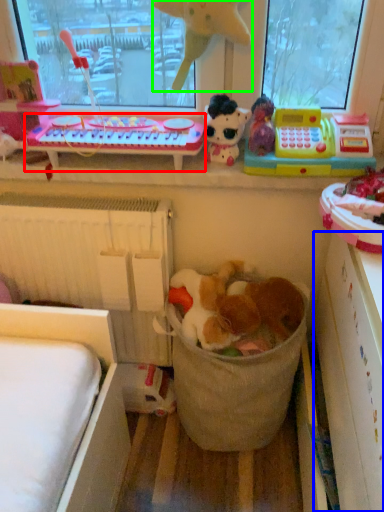
Question: Which object is the closest to the changing table (highlighted by a red box)? Choose among these: shelf (highlighted by a blue box) or toy (highlighted by a green box).

Choices:
 (A) shelf
 (B) toy

Answer: (B)